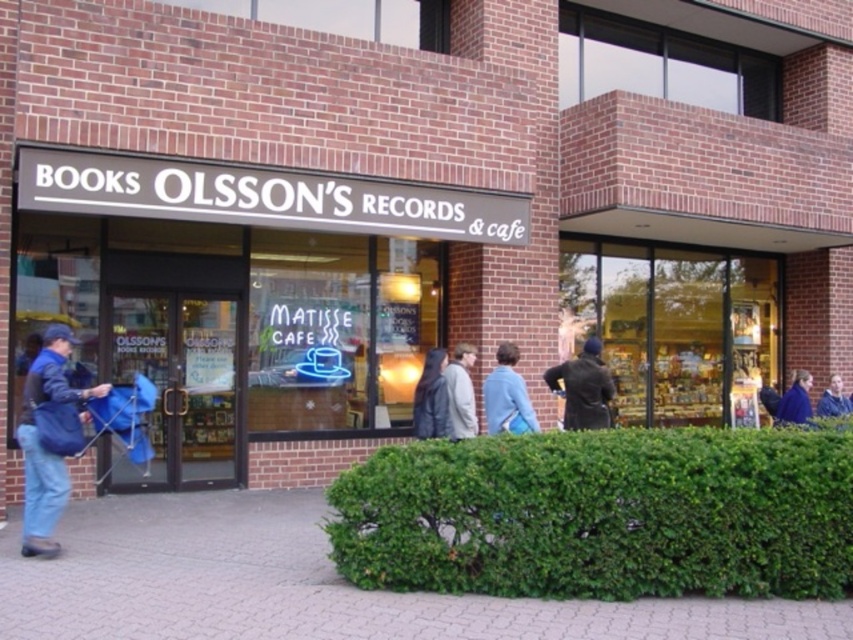
In the scene shown: You are standing in front of the store and want to place both the brick pavement at lower center and the blue fabric bag at lower left on a shelf. Which object should you place first if you want to arrange them from smallest to largest?

The brick pavement at lower center is smaller than the blue fabric bag at lower left, so you should place the brick pavement at lower center first when arranging them from smallest to largest.